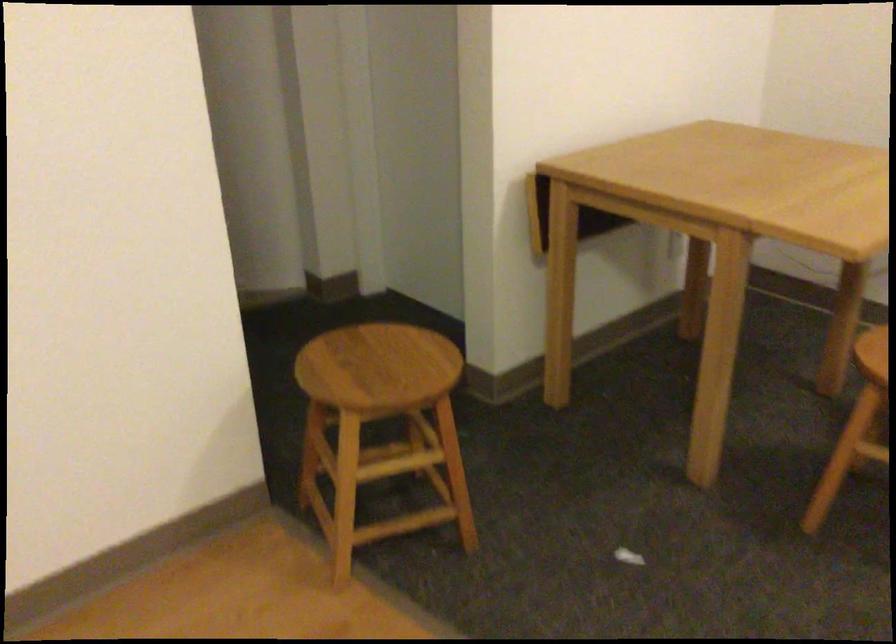
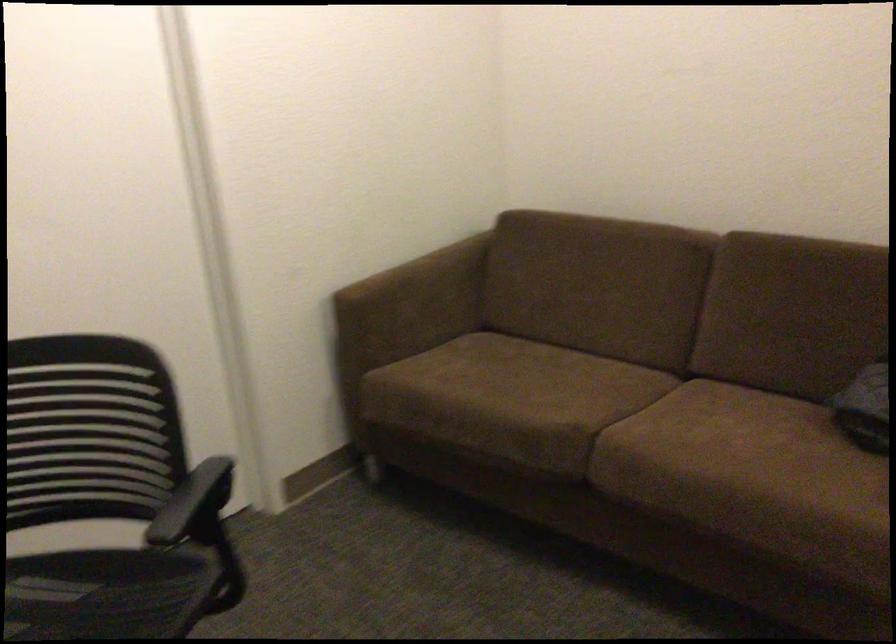
Consider the image. The first image is from the beginning of the video and the second image is from the end. How did the camera likely rotate when shooting the video?

The camera's rotation is toward right-down.